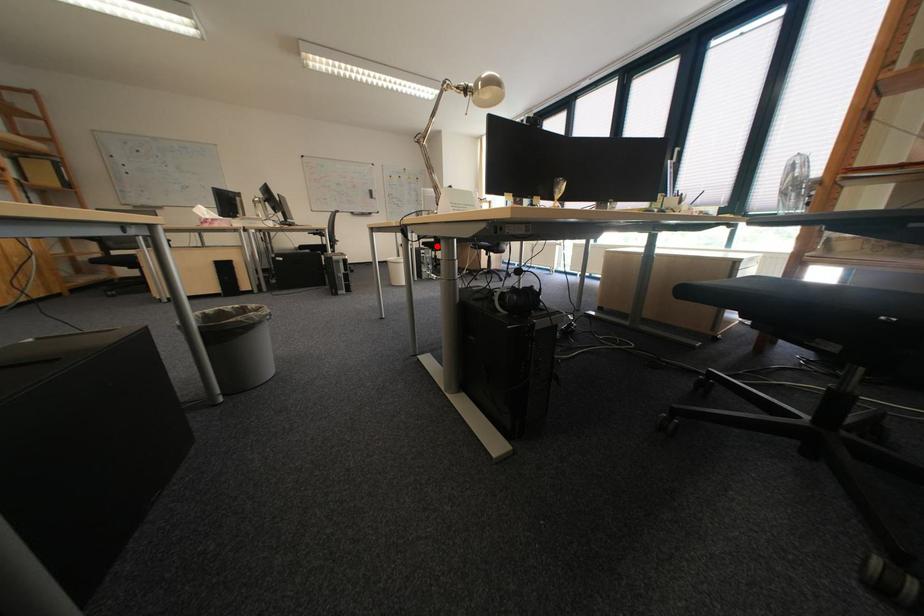
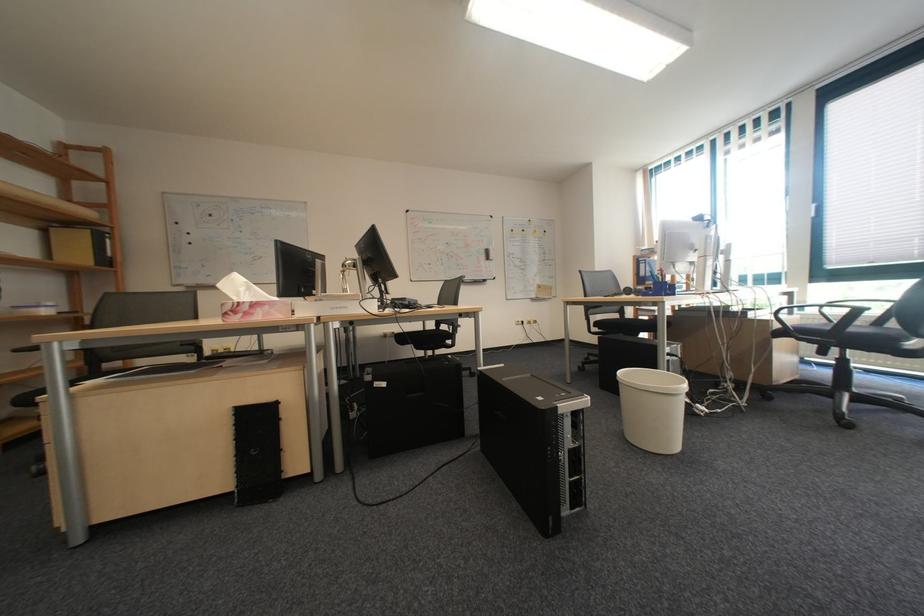
Question: I am providing you with two images of the same scene from different viewpoints. Image1 has a red point marked. In image2, the corresponding 3D location appears at what relative position? Reply with the corresponding letter.

Choices:
 (A) Closer
 (B) Farther

Answer: (B)